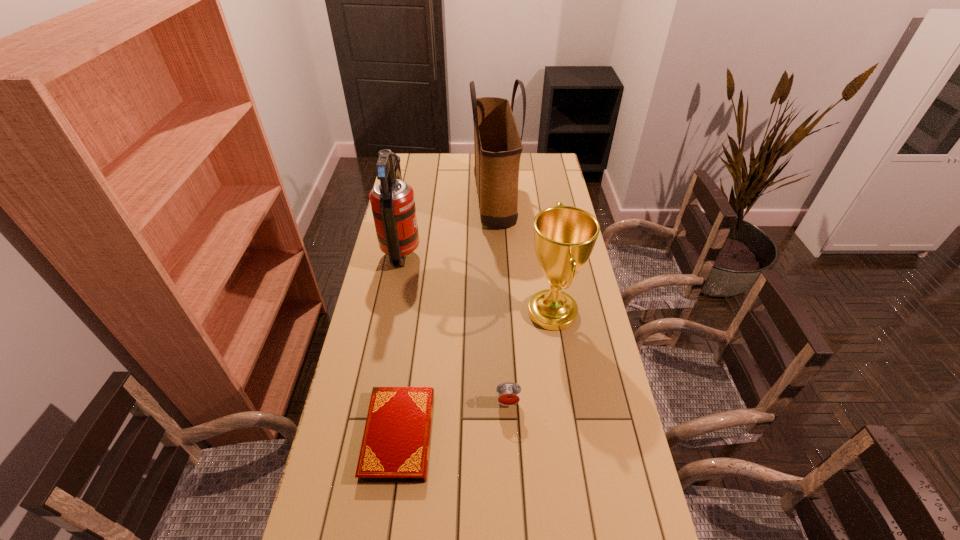
The width and height of the screenshot is (960, 540). I want to click on unoccupied area between the award and the alarm clock, so click(x=530, y=357).

The width and height of the screenshot is (960, 540). I want to click on free point between the alarm clock and the fire extinguisher, so pyautogui.click(x=455, y=327).

Where is `object that can be found as the second closest to the fire extinguisher`? Image resolution: width=960 pixels, height=540 pixels. object that can be found as the second closest to the fire extinguisher is located at coordinates (564, 236).

Locate an element on the screen. object that ranks as the closest to the fourth tallest object is located at coordinates (564, 236).

Locate an element on the screen. free point that satisfies the following two spatial constraints: 1. by the handles of the award; 2. on the cover of the hardback book is located at coordinates (571, 435).

Locate an element on the screen. Image resolution: width=960 pixels, height=540 pixels. vacant space that satisfies the following two spatial constraints: 1. by the handles of the award; 2. on the cover of the shortest object is located at coordinates (571, 435).

Where is `free spot that satisfies the following two spatial constraints: 1. on the front side of the tote bag; 2. on the front label side of the fire extinguisher`? This screenshot has width=960, height=540. free spot that satisfies the following two spatial constraints: 1. on the front side of the tote bag; 2. on the front label side of the fire extinguisher is located at coordinates (496, 252).

This screenshot has height=540, width=960. Find the location of `blank area in the image that satisfies the following two spatial constraints: 1. by the handles of the third nearest object; 2. on the cover of the hardback book`. blank area in the image that satisfies the following two spatial constraints: 1. by the handles of the third nearest object; 2. on the cover of the hardback book is located at coordinates (571, 435).

Image resolution: width=960 pixels, height=540 pixels. What are the coordinates of `vacant region that satisfies the following two spatial constraints: 1. by the handles of the award; 2. on the cover of the hardback book` in the screenshot? It's located at (571, 435).

Find the location of a particular element. This screenshot has width=960, height=540. vacant space that satisfies the following two spatial constraints: 1. by the handles of the third nearest object; 2. on the face of the alarm clock is located at coordinates (566, 402).